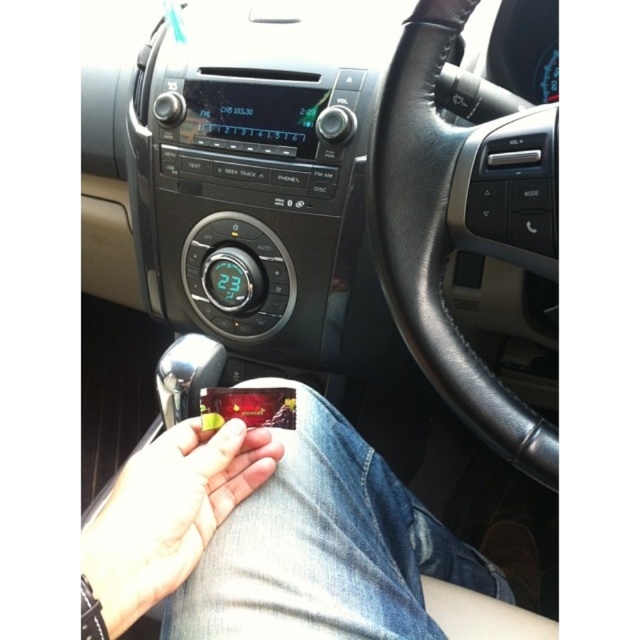
Can you confirm if black leather steering wheel at center is smaller than matte plastic candy at lower center?

No, black leather steering wheel at center is not smaller than matte plastic candy at lower center.

Who is more forward, [376,200] or [177,476]?

Point [177,476] is more forward.

Measure the distance between point (538, 458) and camera.

They are 22.92 inches apart.

You are a GUI agent. You are given a task and a screenshot of the screen. Output one action in this format:
    pyautogui.click(x=<x>, y=<y>)
    Task: Click on the black leather steering wheel at center
    
    Given the screenshot: What is the action you would take?
    pyautogui.click(x=460, y=224)

Can you confirm if matte black steering wheel at center is positioned below smooth leather hand at center?

Actually, matte black steering wheel at center is above smooth leather hand at center.

Which is more to the left, matte black steering wheel at center or smooth leather hand at center?

Positioned to the left is smooth leather hand at center.

Locate an element on the screen. The width and height of the screenshot is (640, 640). matte black steering wheel at center is located at coordinates (323, 547).

Does matte black steering wheel at center appear on the right side of matte plastic candy at lower center?

Correct, you'll find matte black steering wheel at center to the right of matte plastic candy at lower center.

Where is `matte black steering wheel at center`? Image resolution: width=640 pixels, height=640 pixels. matte black steering wheel at center is located at coordinates (323, 547).